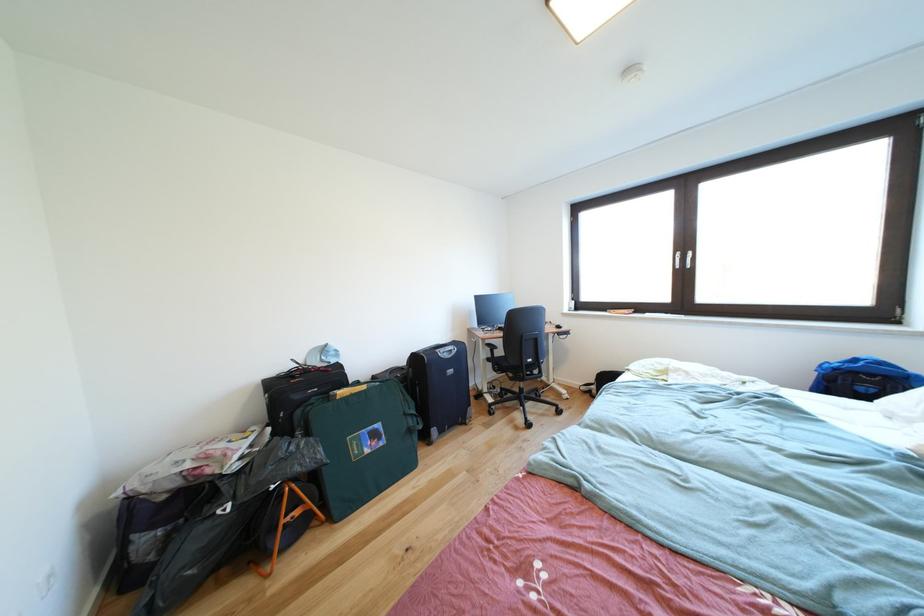
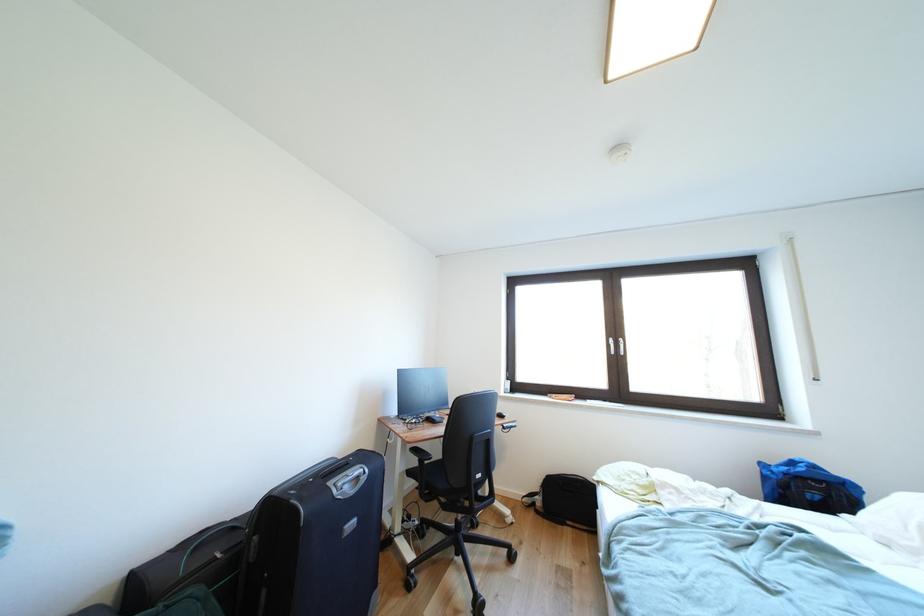
The images are taken continuously from a first-person perspective. In which direction is your viewpoint rotating?

The rotation direction of the camera is right-up.